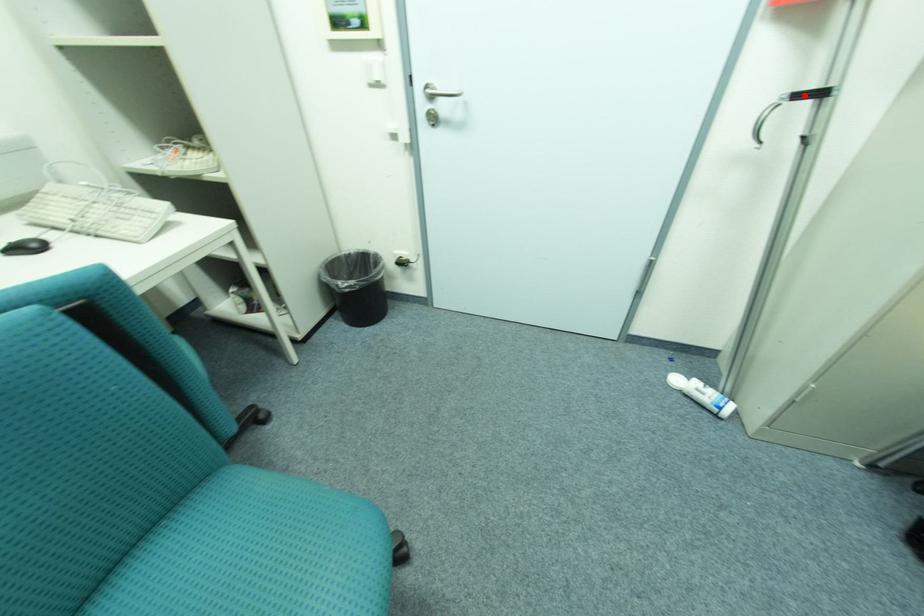
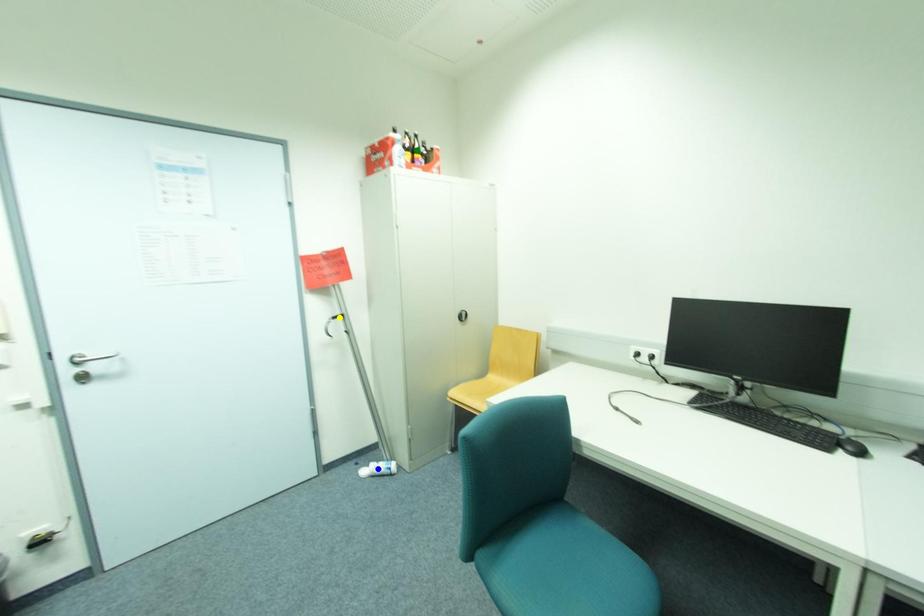
Question: I am providing you with two images of the same scene from different viewpoints. A red point is marked on the first image. You are given multiple points on the second image. In image 2, which mark is for the same physical point as the one in image 1?

Choices:
 (A) green point
 (B) yellow point
 (C) blue point

Answer: (B)